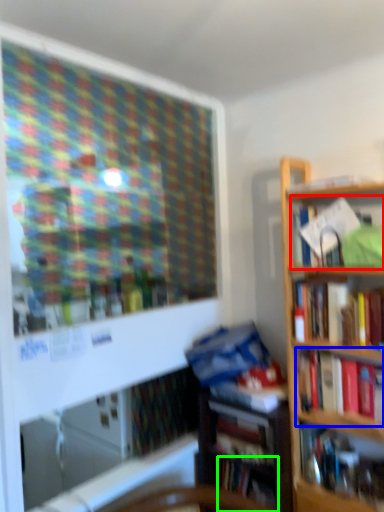
Question: Estimate the real-world distances between objects in this image. Which object is farther from book (highlighted by a red box), book (highlighted by a blue box) or book (highlighted by a green box)?

Choices:
 (A) book
 (B) book

Answer: (B)